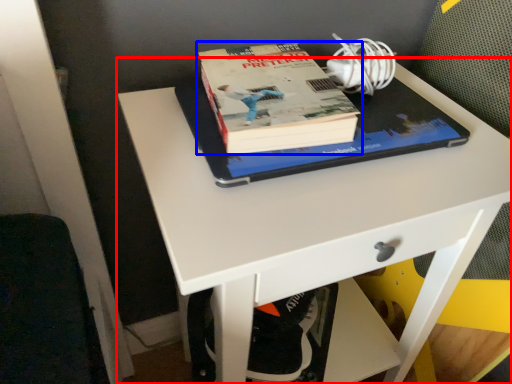
Question: Which object is closer to the camera taking this photo, desk (highlighted by a red box) or book (highlighted by a blue box)?

Choices:
 (A) desk
 (B) book

Answer: (A)